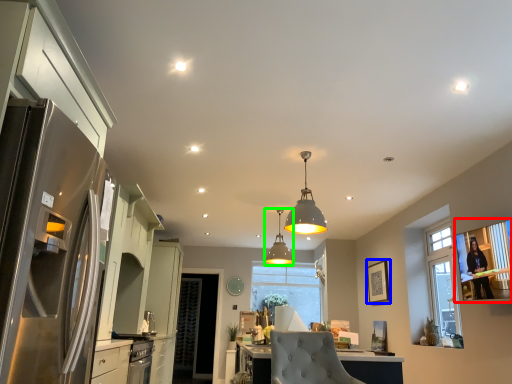
Question: Estimate the real-world distances between objects in this image. Which object is farther from window screen (highlighted by a red box), picture frame (highlighted by a blue box) or lamp (highlighted by a green box)?

Choices:
 (A) picture frame
 (B) lamp

Answer: (B)